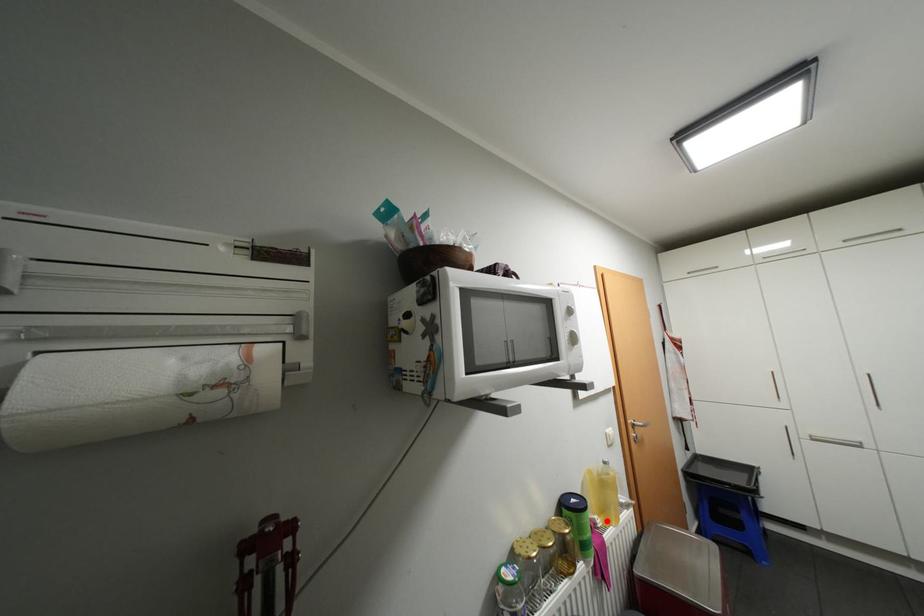
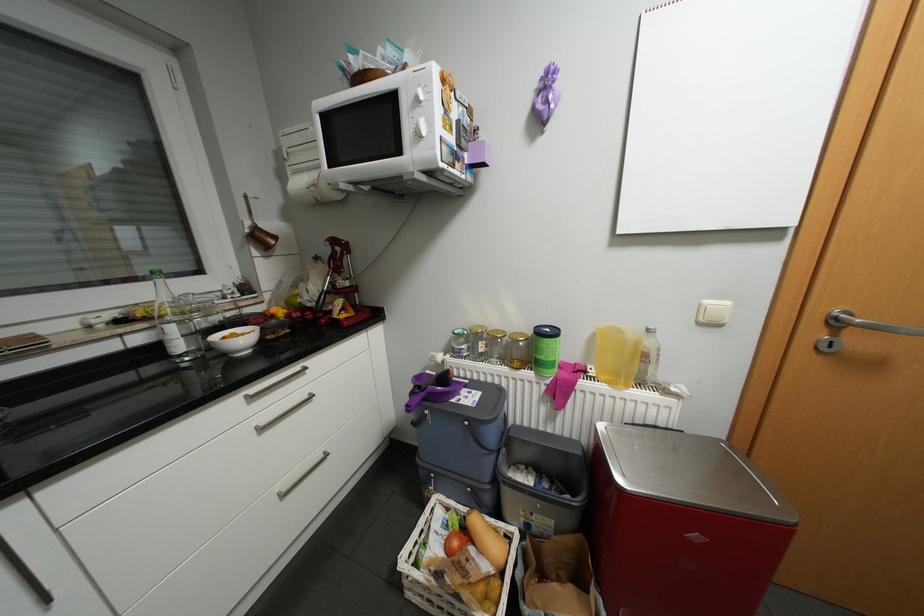
In the second image, find the point that corresponds to the highlighted location in the first image.

(600, 371)